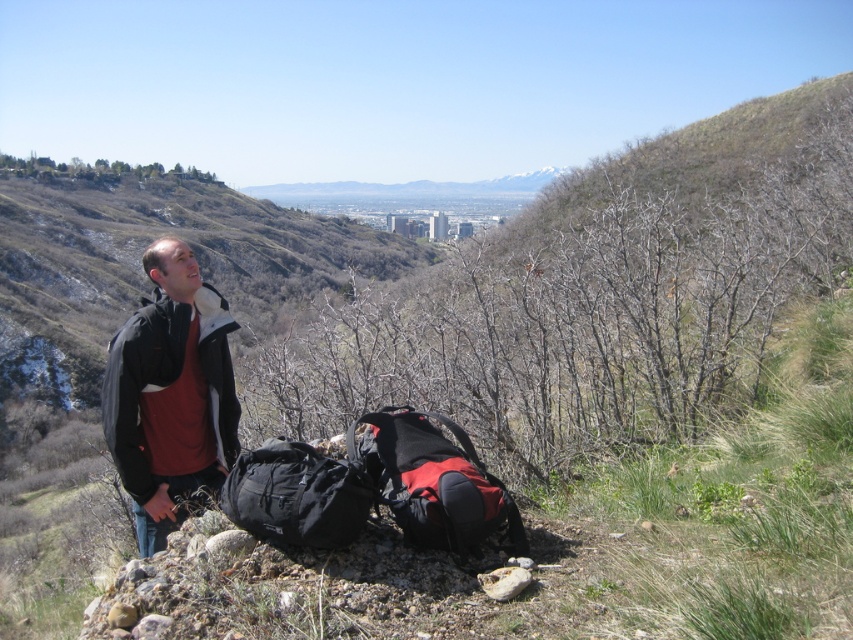
Question: Where is red matte backpack at center located in relation to smooth gray rock at lower left in the image?

Choices:
 (A) above
 (B) below

Answer: (A)

Question: Which point is farther from the camera taking this photo?

Choices:
 (A) (112, 381)
 (B) (128, 620)
 (C) (502, 509)
 (D) (277, 529)

Answer: (A)

Question: Which of the following is the closest to the observer?

Choices:
 (A) (115, 604)
 (B) (242, 532)
 (C) (265, 484)

Answer: (A)

Question: Is dark gray fleece jacket at center thinner than gray rock at lower center?

Choices:
 (A) no
 (B) yes

Answer: (A)

Question: Does red matte backpack at center appear under gray rock at lower center?

Choices:
 (A) yes
 (B) no

Answer: (B)

Question: Among these points, which one is nearest to the camera?

Choices:
 (A) (379, 426)
 (B) (213, 540)

Answer: (B)